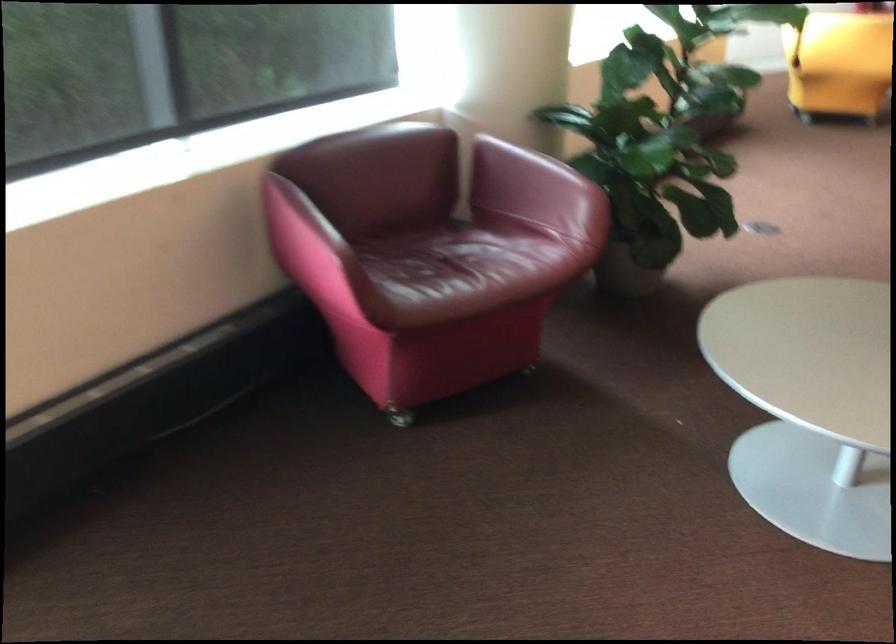
You are a GUI agent. You are given a task and a screenshot of the screen. Output one action in this format:
    pyautogui.click(x=<x>, y=<y>)
    Task: Click on the pink chair armrest
    The image size is (896, 644).
    Given the screenshot: What is the action you would take?
    pyautogui.click(x=543, y=169)